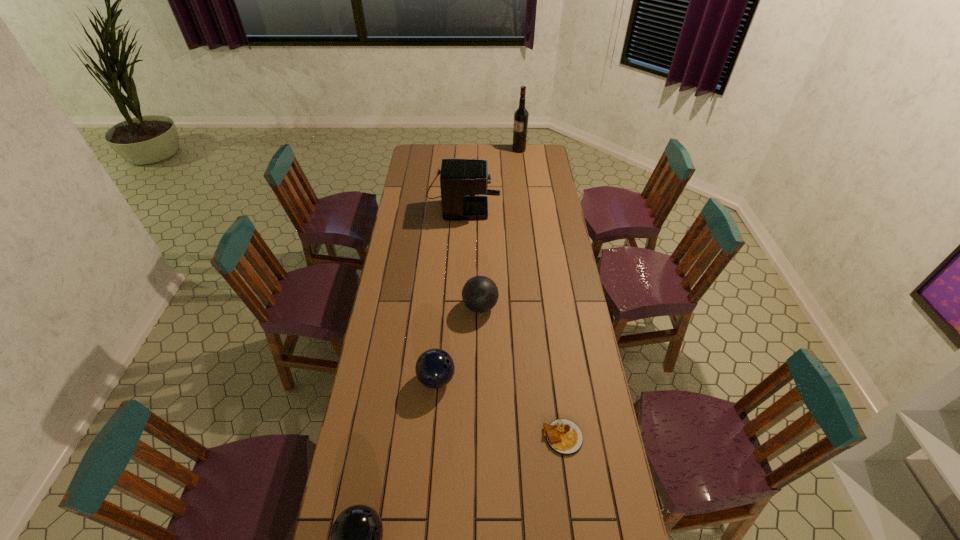
Find the location of `object at the left edge`. object at the left edge is located at coordinates (460, 179).

At what (x,y) coordinates should I click in order to perform the action: click on wine bottle that is at the right edge. Please return your answer as a coordinate pair (x, y). This screenshot has height=540, width=960. Looking at the image, I should click on (521, 115).

You are a GUI agent. You are given a task and a screenshot of the screen. Output one action in this format:
    pyautogui.click(x=<x>, y=<y>)
    Task: Click on the omelet that is at the right edge
    This screenshot has width=960, height=540.
    Given the screenshot: What is the action you would take?
    pyautogui.click(x=563, y=436)

At what (x,y) coordinates should I click in order to perform the action: click on object situated at the far right corner. Please return your answer as a coordinate pair (x, y). The height and width of the screenshot is (540, 960). Looking at the image, I should click on (521, 115).

The width and height of the screenshot is (960, 540). In the image, there is a desktop. What are the coordinates of `free space at the far edge` in the screenshot? It's located at (443, 154).

Identify the location of blank area at the left edge. (392, 426).

In the image, there is a desktop. Where is `vacant space at the right edge`? vacant space at the right edge is located at coordinates coord(532,176).

In the image, there is a desktop. Where is `free space at the far left corner`? The height and width of the screenshot is (540, 960). free space at the far left corner is located at coordinates (420, 151).

The width and height of the screenshot is (960, 540). I want to click on free spot between the coffee maker and the fourth nearest object, so click(471, 251).

Where is `vacant area between the coffee maker and the fourth farthest object`? The height and width of the screenshot is (540, 960). vacant area between the coffee maker and the fourth farthest object is located at coordinates (449, 287).